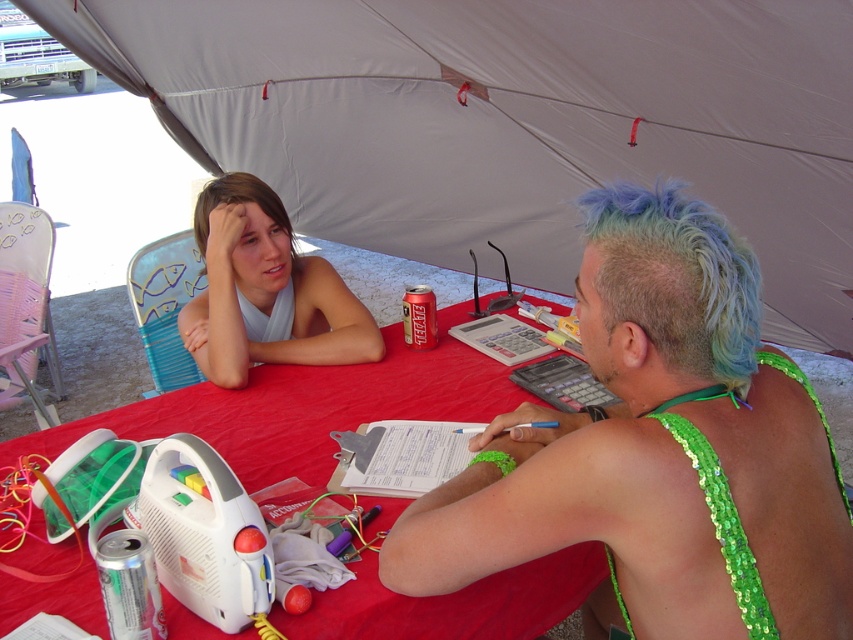
You are standing at the edge of the tent and want to walk towards the table. There are two points marked on the table surface. If you were to walk directly towards the table, which of the two points, point (335,349) or point (206,189), would appear closer to you as you approach?

Point (335,349) is further to the viewer than point (206,189), so as you approach the table, point (335,349) would appear closer to you.

Based on the scene description, which person has a taller hairstyle between the blue dyed hair at upper right and the blonde hair at upper left?

The blue dyed hair at upper right has a greater height compared to the blonde hair at upper left, so the blue dyed hair at upper right is taller.